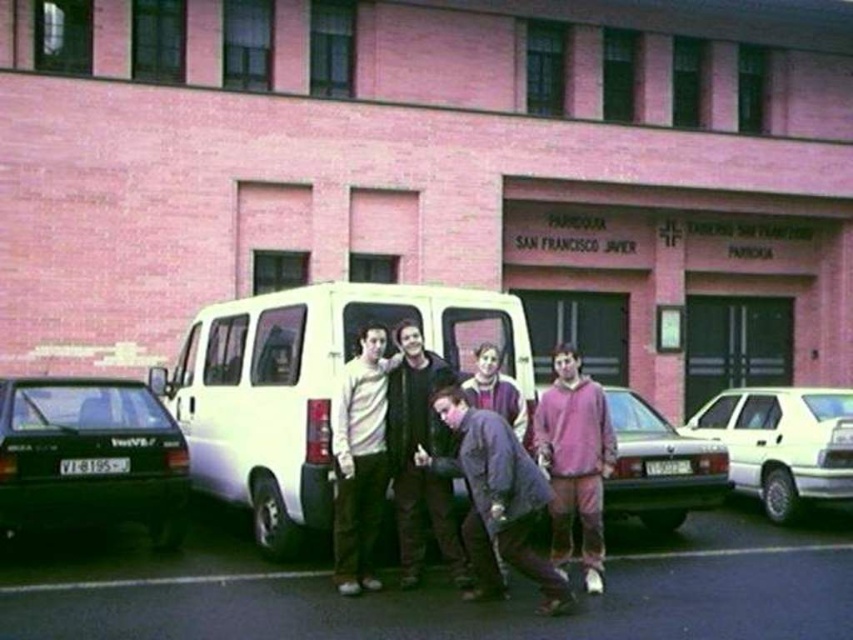
Question: Is striped sweater at center wider than purple woolen sweater at center?

Choices:
 (A) no
 (B) yes

Answer: (B)

Question: Does green matte hatchback at left appear on the left side of white glossy sedan at right?

Choices:
 (A) yes
 (B) no

Answer: (A)

Question: Which point is farther to the camera?

Choices:
 (A) purple woolen sweater at center
 (B) striped sweater at center
 (C) white glossy sedan at right
 (D) green matte hatchback at left

Answer: (C)

Question: Does green matte hatchback at left have a smaller size compared to pink matte car at center?

Choices:
 (A) yes
 (B) no

Answer: (A)

Question: Which object is closer to the camera taking this photo?

Choices:
 (A) purple fleece sweatshirt at center
 (B) dark brown leather jacket at center
 (C) black asphalt at lower center
 (D) purple woolen sweater at center

Answer: (C)

Question: Which of the following is the farthest from the observer?

Choices:
 (A) 498,358
 (B) 621,499
 (C) 38,563

Answer: (B)